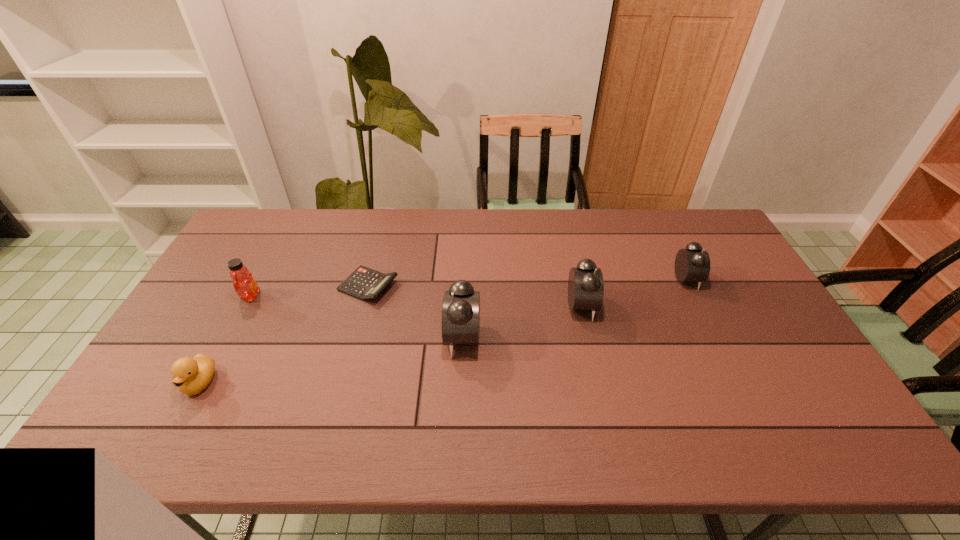
I want to click on vacant space in between the second shortest alarm clock and the duckling, so click(391, 345).

At what (x,y) coordinates should I click in order to perform the action: click on vacant area that lies between the duckling and the honey. Please return your answer as a coordinate pair (x, y). The width and height of the screenshot is (960, 540). Looking at the image, I should click on (226, 339).

Identify the location of free space that is in between the fourth object from right to left and the honey. click(x=310, y=291).

Locate an element on the screen. empty space that is in between the honey and the nearest object is located at coordinates (226, 339).

You are a GUI agent. You are given a task and a screenshot of the screen. Output one action in this format:
    pyautogui.click(x=<x>, y=<y>)
    Task: Click on the object that stands as the third closest to the leftmost alarm clock
    This screenshot has height=540, width=960.
    Given the screenshot: What is the action you would take?
    pyautogui.click(x=244, y=284)

Select which object is the second closest to the duckling. Please provide its 2D coordinates. Your answer should be formatted as a tuple, i.e. [(x, y)], where the tuple contains the x and y coordinates of a point satisfying the conditions above.

[(364, 283)]

You are a GUI agent. You are given a task and a screenshot of the screen. Output one action in this format:
    pyautogui.click(x=<x>, y=<y>)
    Task: Click on the alarm clock that is the second closest to the second alarm clock from left to right
    The width and height of the screenshot is (960, 540).
    Given the screenshot: What is the action you would take?
    pyautogui.click(x=692, y=264)

Identify which alarm clock is the second closest to the rightmost object. Please provide its 2D coordinates. Your answer should be formatted as a tuple, i.e. [(x, y)], where the tuple contains the x and y coordinates of a point satisfying the conditions above.

[(460, 321)]

I want to click on vacant space that satisfies the following two spatial constraints: 1. on the front side of the third object from left to right; 2. on the front label of the honey, so click(x=366, y=296).

Locate an element on the screen. The height and width of the screenshot is (540, 960). vacant space that satisfies the following two spatial constraints: 1. on the front side of the second tallest alarm clock; 2. on the face of the duckling is located at coordinates point(599,382).